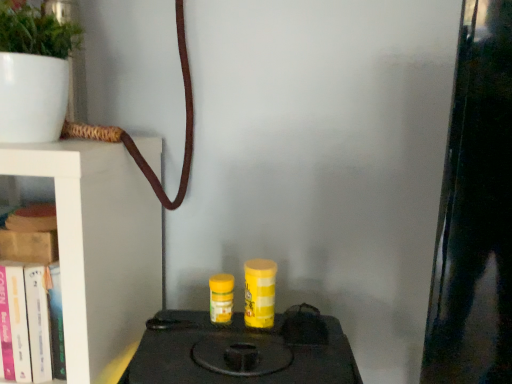
Question: From a real-world perspective, is white matte pot at upper left located beneath hardcover book at left, acting as the second book starting from the top?

Choices:
 (A) no
 (B) yes

Answer: (A)

Question: Is white matte pot at upper left next to hardcover book at left, acting as the second book starting from the top?

Choices:
 (A) yes
 (B) no

Answer: (B)

Question: Is white matte pot at upper left outside hardcover book at left, marked as the 1th book in a bottom-to-top arrangement?

Choices:
 (A) no
 (B) yes

Answer: (B)

Question: Does white matte pot at upper left have a smaller size compared to hardcover book at left, acting as the second book starting from the top?

Choices:
 (A) no
 (B) yes

Answer: (A)

Question: Is the depth of white matte pot at upper left less than that of hardcover book at left, marked as the 1th book in a bottom-to-top arrangement?

Choices:
 (A) yes
 (B) no

Answer: (A)

Question: From the image's perspective, would you say white matte pot at upper left is shown under hardcover book at left, marked as the 1th book in a bottom-to-top arrangement?

Choices:
 (A) yes
 (B) no

Answer: (B)

Question: Does hardcover book at left, marked as the 1th book in a bottom-to-top arrangement, lie in front of black matte stove at center?

Choices:
 (A) no
 (B) yes

Answer: (A)

Question: Can you confirm if hardcover book at left, marked as the 1th book in a bottom-to-top arrangement, is taller than black matte stove at center?

Choices:
 (A) yes
 (B) no

Answer: (B)

Question: Considering the relative positions of hardcover book at left, acting as the second book starting from the top, and black matte stove at center in the image provided, is hardcover book at left, acting as the second book starting from the top, to the right of black matte stove at center from the viewer's perspective?

Choices:
 (A) yes
 (B) no

Answer: (B)

Question: From a real-world perspective, is hardcover book at left, marked as the 1th book in a bottom-to-top arrangement, positioned under black matte stove at center based on gravity?

Choices:
 (A) yes
 (B) no

Answer: (B)

Question: From the image's perspective, is hardcover book at left, marked as the 1th book in a bottom-to-top arrangement, below black matte stove at center?

Choices:
 (A) yes
 (B) no

Answer: (B)

Question: Is hardcover book at left, marked as the 1th book in a bottom-to-top arrangement, to the left of black matte stove at center from the viewer's perspective?

Choices:
 (A) yes
 (B) no

Answer: (A)

Question: Is hardcover book at left, acting as the second book starting from the top, aimed at white matte pot at upper left?

Choices:
 (A) yes
 (B) no

Answer: (B)